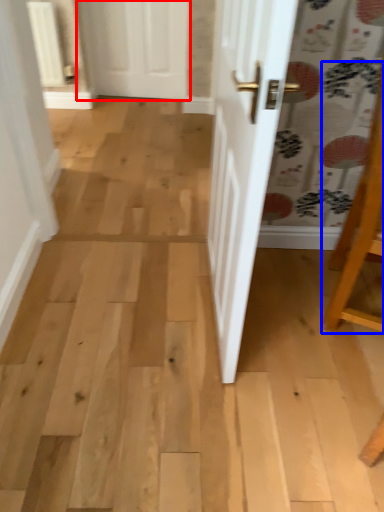
Question: Which point is closer to the camera, door (highlighted by a red box) or furniture (highlighted by a blue box)?

Choices:
 (A) door
 (B) furniture

Answer: (B)